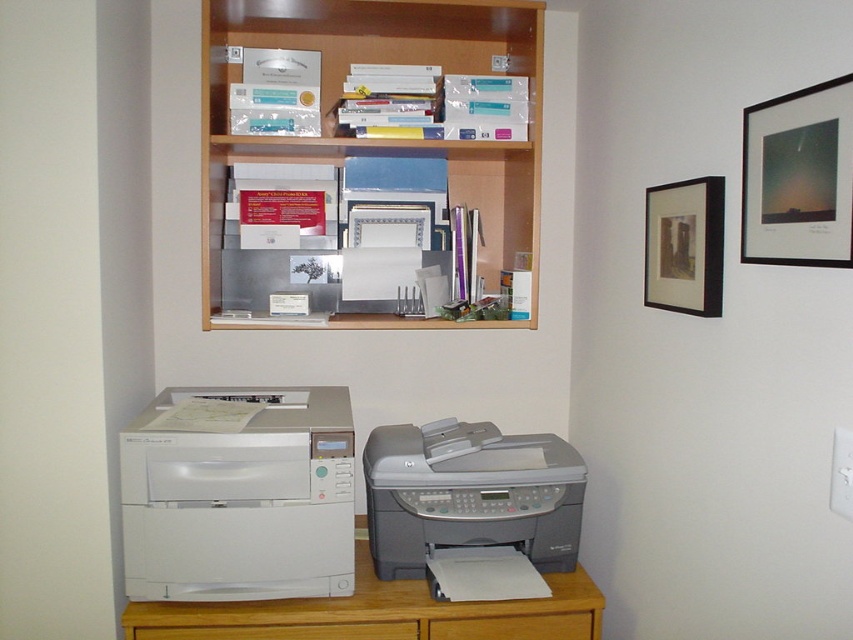
Please provide the 2D coordinates of the wooden bookshelf at upper center in the image.

The wooden bookshelf at upper center is located at coordinates 0.217 on the x axis and 0.447 on the y axis.

You are organizing the office and need to move the wooden bookshelf at upper center closer to the white matte printer at lower left. Based on their current positions, which object is already nearer to you?

The white matte printer at lower left is closer to the viewer than the wooden bookshelf at upper center, so the white matte printer at lower left is already nearer to you.